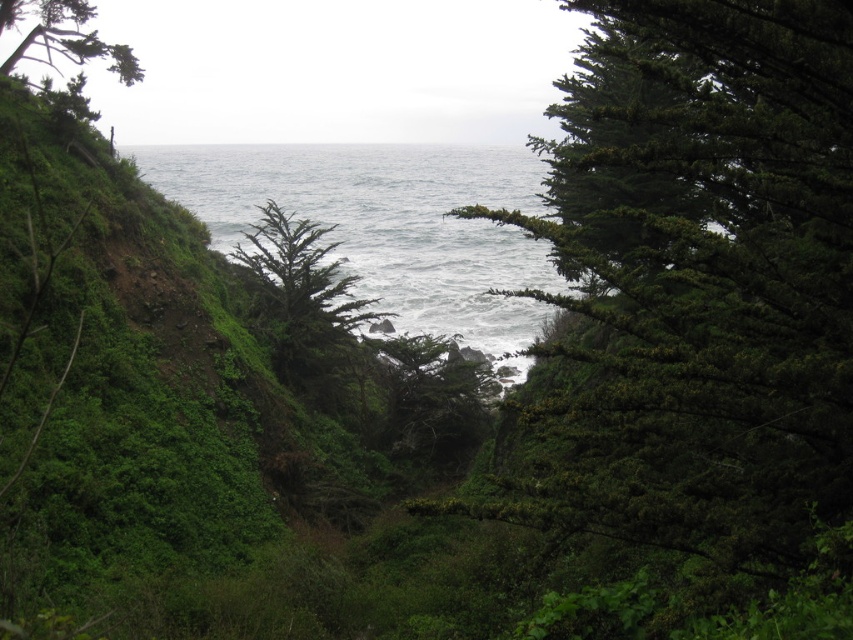
You are a photographer standing in the coastal scene and want to capture a photo of the gray water at center and the green textured tree at upper left. Can you see both objects in the same frame without moving your camera?

The gray water at center is positioned over the green textured tree at upper left, so yes, both objects can be captured in the same frame without moving the camera as they are layered on top of each other.